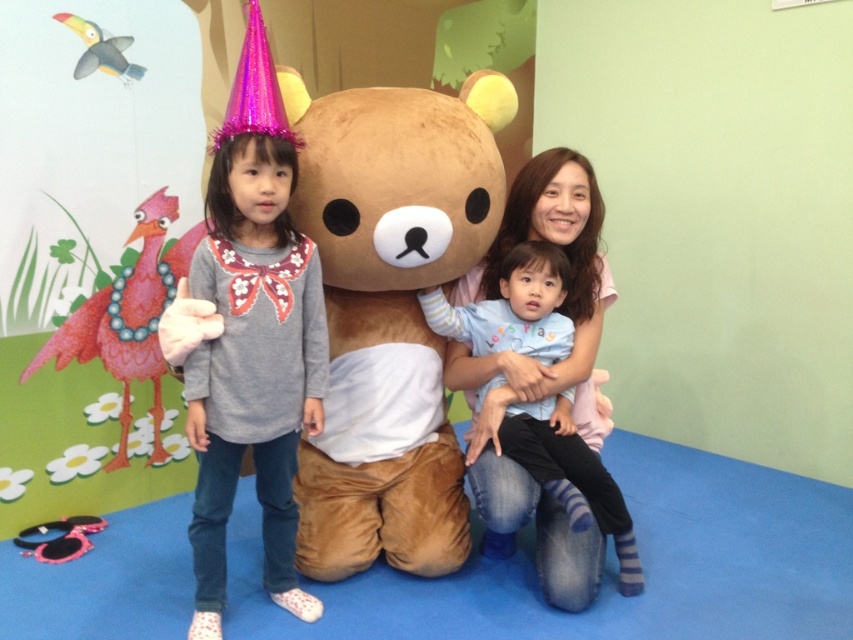
Can you confirm if matte gray sweater at center is shorter than light blue cotton shirt at center?

Incorrect, matte gray sweater at center's height does not fall short of light blue cotton shirt at center's.

Does matte gray sweater at center appear over light blue cotton shirt at center?

Yes, matte gray sweater at center is above light blue cotton shirt at center.

At what (x,y) coordinates should I click in order to perform the action: click on matte gray sweater at center. Please return your answer as a coordinate pair (x, y). Looking at the image, I should click on (252, 368).

You are a GUI agent. You are given a task and a screenshot of the screen. Output one action in this format:
    pyautogui.click(x=<x>, y=<y>)
    Task: Click on the matte gray sweater at center
    
    Given the screenshot: What is the action you would take?
    pyautogui.click(x=252, y=368)

Can you confirm if brown plush bear at center is bigger than light blue cotton shirt at center?

Correct, brown plush bear at center is larger in size than light blue cotton shirt at center.

Which of these two, brown plush bear at center or light blue cotton shirt at center, stands shorter?

Standing shorter between the two is light blue cotton shirt at center.

Between point (363, 150) and point (577, 445), which one is positioned in front?

Point (363, 150) is more forward.

Identify the location of brown plush bear at center. (390, 312).

Who is higher up, brown plush bear at center or matte gray sweater at center?

brown plush bear at center is above.

What do you see at coordinates (390, 312) in the screenshot? The image size is (853, 640). I see `brown plush bear at center` at bounding box center [390, 312].

Find the location of `brown plush bear at center`. brown plush bear at center is located at coordinates (390, 312).